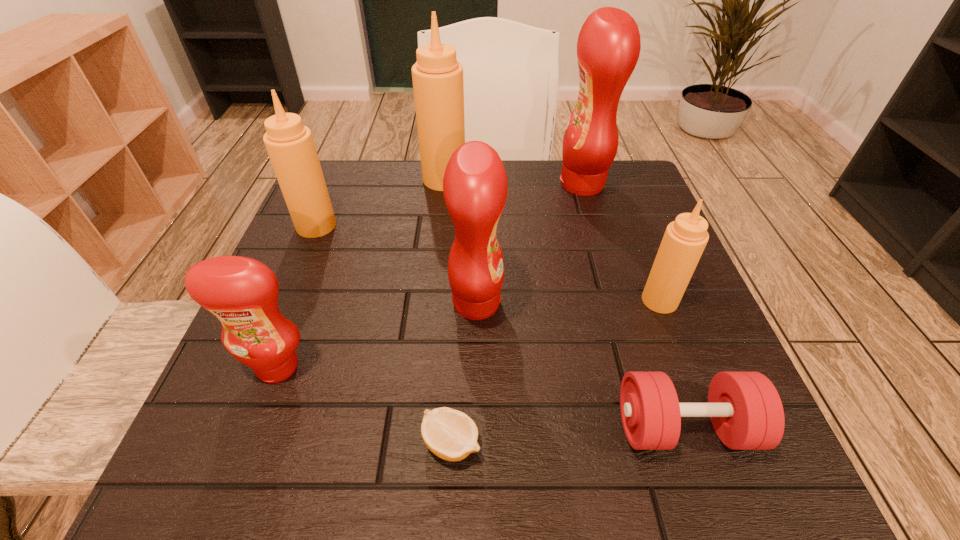
The image size is (960, 540). I want to click on the rightmost red condiment, so click(608, 47).

Locate an element on the screen. the biggest red condiment is located at coordinates (608, 47).

The image size is (960, 540). Find the location of `the farthest tan condiment`. the farthest tan condiment is located at coordinates (437, 76).

I want to click on the biggest tan condiment, so click(437, 76).

This screenshot has height=540, width=960. I want to click on the third farthest condiment, so click(x=290, y=145).

The height and width of the screenshot is (540, 960). In order to click on the third farthest object in this screenshot , I will do `click(290, 145)`.

Locate an element on the screen. The image size is (960, 540). the second red condiment from right to left is located at coordinates tap(475, 185).

Find the location of a particular element. The height and width of the screenshot is (540, 960). the second biggest red condiment is located at coordinates (475, 185).

The image size is (960, 540). What are the coordinates of `the smallest tan condiment` in the screenshot? It's located at [684, 240].

Where is `the nearest tan condiment`? This screenshot has width=960, height=540. the nearest tan condiment is located at coordinates (684, 240).